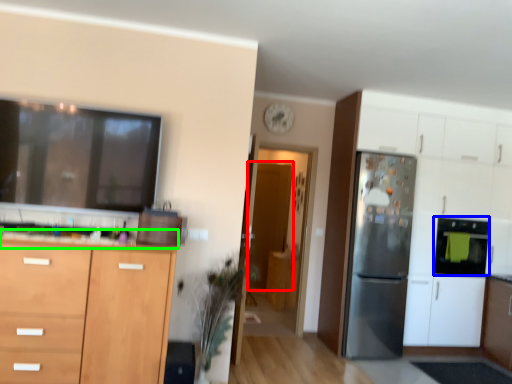
Question: Estimate the real-world distances between objects in this image. Which object is closer to glass door (highlighted by a red box), appliance (highlighted by a blue box) or countertop (highlighted by a green box)?

Choices:
 (A) appliance
 (B) countertop

Answer: (A)